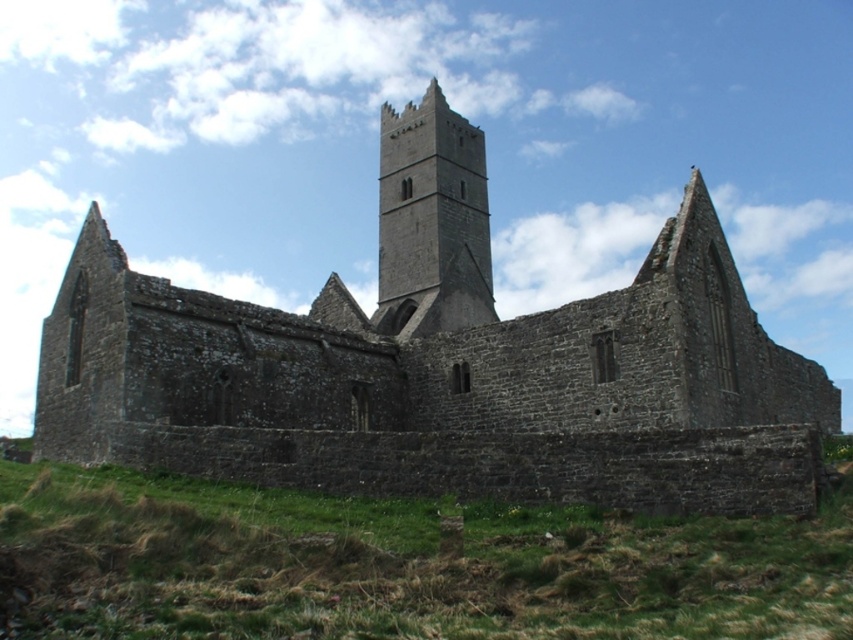
Question: Based on their relative distances, which object is farther from the dark gray stone tower at center?

Choices:
 (A) gray stone church at center
 (B) green grass at lower center

Answer: (B)

Question: Which object is farther from the camera taking this photo?

Choices:
 (A) green grass at lower center
 (B) dark gray stone tower at center

Answer: (B)

Question: Is gray stone church at center below green grass at lower center?

Choices:
 (A) no
 (B) yes

Answer: (A)

Question: Does gray stone church at center have a larger size compared to green grass at lower center?

Choices:
 (A) yes
 (B) no

Answer: (A)

Question: Is gray stone church at center positioned before green grass at lower center?

Choices:
 (A) yes
 (B) no

Answer: (B)

Question: Among these objects, which one is nearest to the camera?

Choices:
 (A) gray stone church at center
 (B) green grass at lower center
 (C) dark gray stone tower at center

Answer: (B)